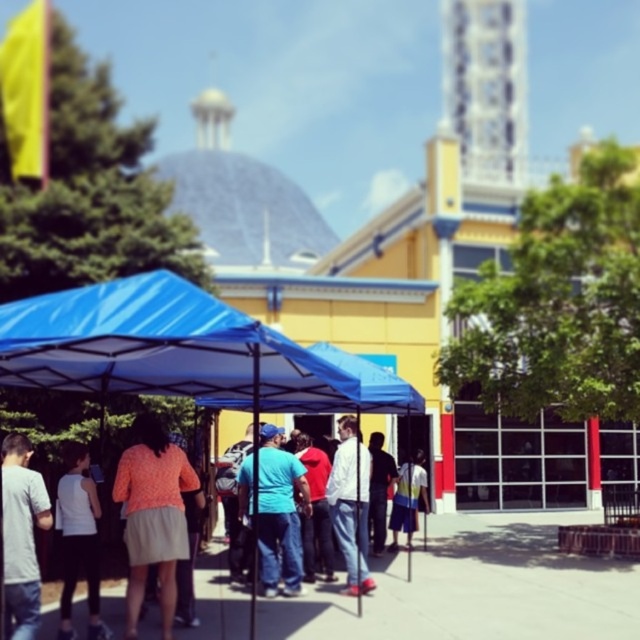
Does gray cotton t-shirt at lower left appear on the right side of yellow fabric shorts at center?

No, gray cotton t-shirt at lower left is not to the right of yellow fabric shorts at center.

Is gray cotton t-shirt at lower left behind yellow fabric shorts at center?

No, gray cotton t-shirt at lower left is closer to the viewer.

Identify the location of gray cotton t-shirt at lower left. The image size is (640, 640). (x=20, y=536).

Between point (68, 451) and point (369, 522), which one is positioned behind?

Positioned behind is point (369, 522).

Locate an element on the screen. white matte tank top at lower left is located at coordinates (77, 540).

Which of these two, blue cotton shirt at center or yellow fabric shorts at center, stands taller?

Standing taller between the two is blue cotton shirt at center.

Does blue cotton shirt at center appear over yellow fabric shorts at center?

Yes, blue cotton shirt at center is above yellow fabric shorts at center.

I want to click on blue cotton shirt at center, so click(275, 512).